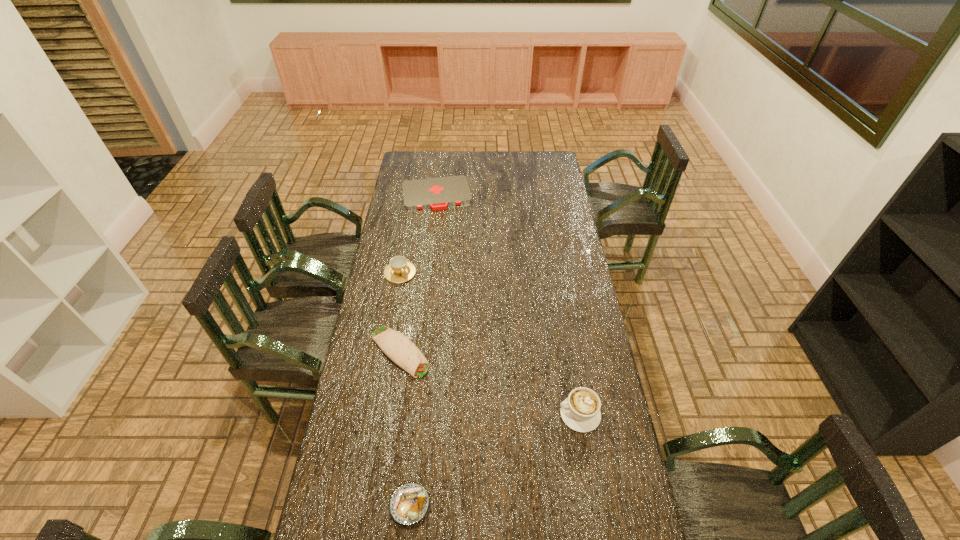
Find the location of a particular element. This screenshot has width=960, height=540. vacant space located 0.250m with the handle on the side of the fourth nearest object is located at coordinates (428, 323).

Where is `object that is positioned at the near edge`? object that is positioned at the near edge is located at coordinates (409, 503).

Where is `the first-aid kit located at the left edge`? the first-aid kit located at the left edge is located at coordinates (438, 193).

Find the location of a particular element. Image resolution: width=960 pixels, height=540 pixels. burrito at the left edge is located at coordinates (396, 346).

In order to click on cup positioned at the left edge in this screenshot , I will do `click(399, 270)`.

This screenshot has height=540, width=960. What are the coordinates of `object that is at the right edge` in the screenshot? It's located at pos(580,411).

Locate an element on the screen. The image size is (960, 540). free region at the far edge is located at coordinates (486, 163).

The image size is (960, 540). I want to click on free space at the left edge of the desktop, so click(385, 264).

Find the location of a particular element. The width and height of the screenshot is (960, 540). free space at the right edge is located at coordinates (549, 279).

I want to click on free space between the fourth nearest object and the burrito, so (x=400, y=312).